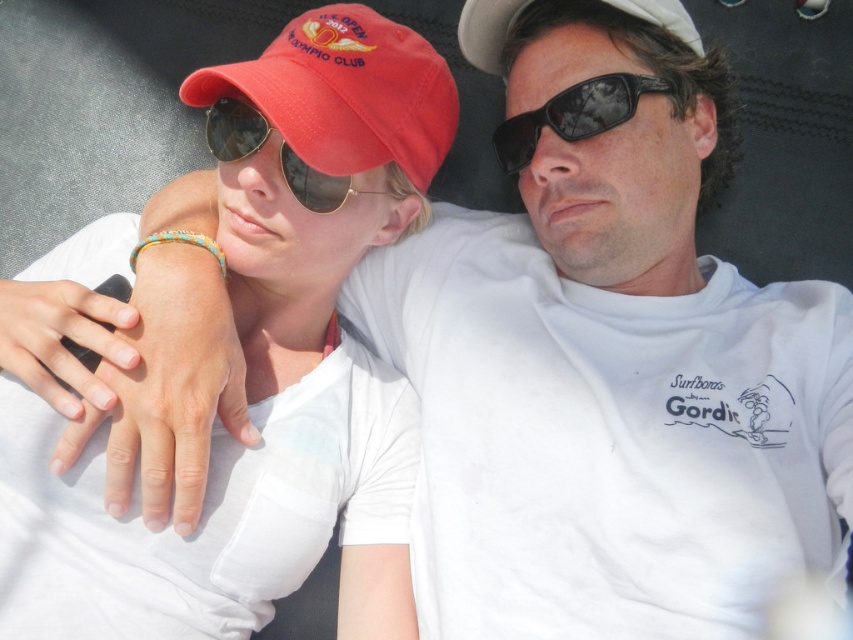
Does matte red baseball cap at upper left have a lesser height compared to matte black sunglasses at upper left?

No.

Between point (384, 161) and point (283, 150), which one is positioned in front?

Point (283, 150) is more forward.

Describe the element at coordinates (346, 92) in the screenshot. Image resolution: width=853 pixels, height=640 pixels. I see `matte red baseball cap at upper left` at that location.

Locate an element on the screen. matte red baseball cap at upper left is located at coordinates (346, 92).

From the picture: Between matte black sunglasses at upper left and white fabric baseball cap at upper center, which one appears on the left side from the viewer's perspective?

From the viewer's perspective, matte black sunglasses at upper left appears more on the left side.

Can you confirm if matte black sunglasses at upper left is thinner than white fabric baseball cap at upper center?

Yes, matte black sunglasses at upper left is thinner than white fabric baseball cap at upper center.

Between point (239, 100) and point (672, 20), which one is positioned in front?

Point (239, 100)

The width and height of the screenshot is (853, 640). Find the location of `matte black sunglasses at upper left`. matte black sunglasses at upper left is located at coordinates (234, 129).

Is matte white t-shirt at center above black reflective sunglasses at center?

No.

Which is below, matte white t-shirt at center or black reflective sunglasses at center?

Positioned lower is matte white t-shirt at center.

Identify the location of matte white t-shirt at center. This screenshot has height=640, width=853. (263, 364).